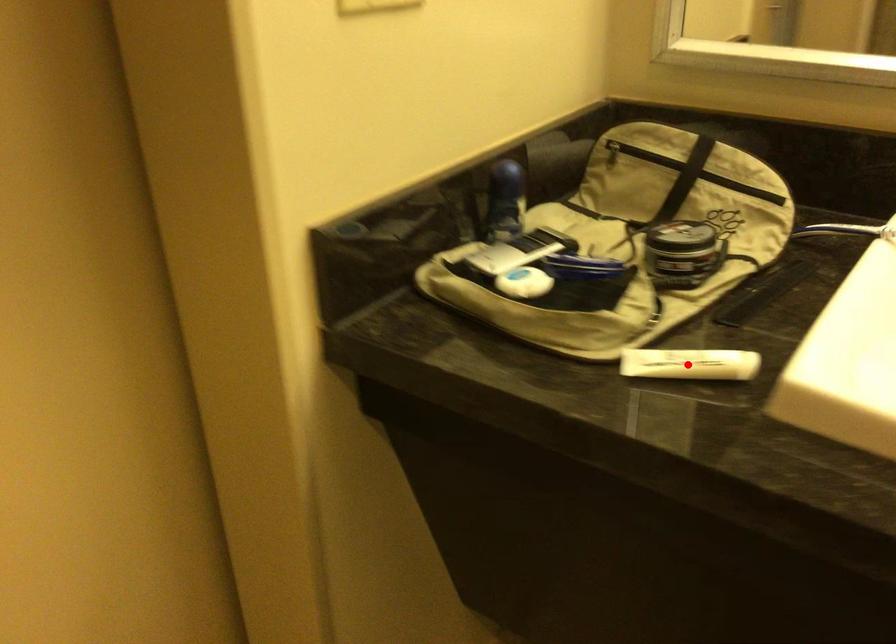
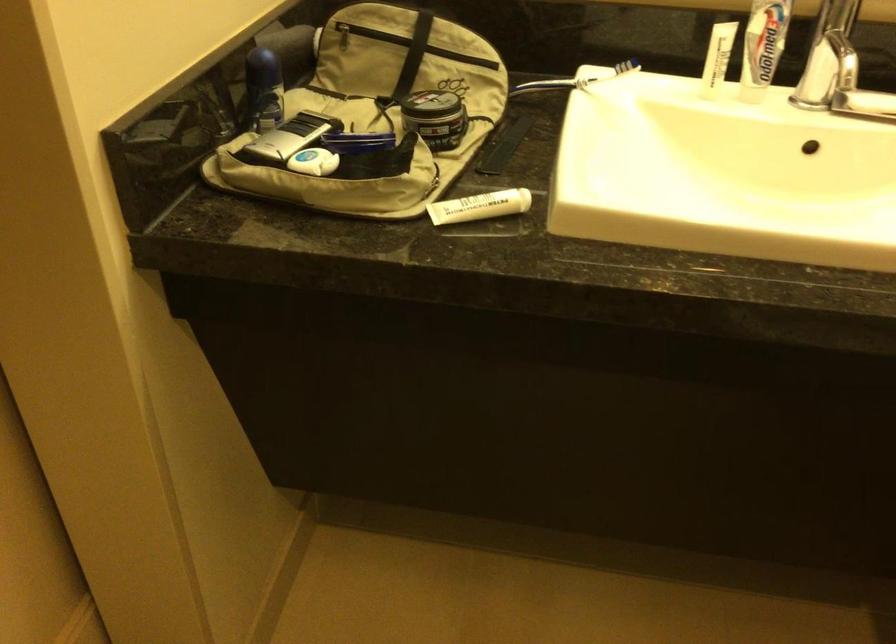
Question: I am providing you with two images of the same scene from different viewpoints. In image1, a red point is highlighted. Considering the same 3D point in image2, which of the following is correct?

Choices:
 (A) It is closer
 (B) It is farther

Answer: (B)